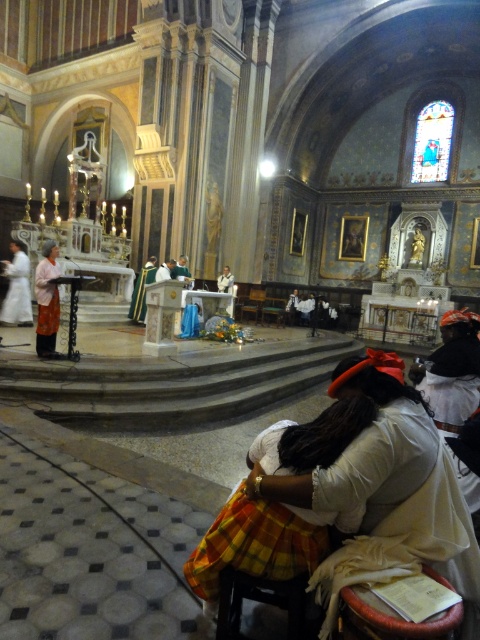
Question: Among these points, which one is farthest from the camera?

Choices:
 (A) (41, 298)
 (B) (288, 502)

Answer: (A)

Question: Can you confirm if white cotton dress at lower right is positioned below matte brown robe at left?

Choices:
 (A) no
 (B) yes

Answer: (B)

Question: Which object is positioned closest to the matte brown robe at left?

Choices:
 (A) wooden chair at center
 (B) white cotton dress at lower right
 (C) green velvet robe at center

Answer: (C)

Question: Which object appears farthest from the camera in this image?

Choices:
 (A) white matte robe at left
 (B) green velvet robe at center
 (C) wooden chair at center

Answer: (C)

Question: Does white cotton dress at lower right lie behind green velvet robe at center?

Choices:
 (A) no
 (B) yes

Answer: (A)

Question: Can you confirm if white matte robe at left is positioned below wooden chair at center?

Choices:
 (A) yes
 (B) no

Answer: (A)